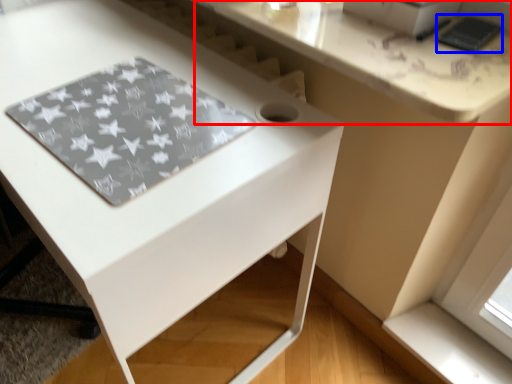
Question: Which object appears farthest to the camera in this image, counter top (highlighted by a red box) or pad (highlighted by a blue box)?

Choices:
 (A) counter top
 (B) pad

Answer: (B)